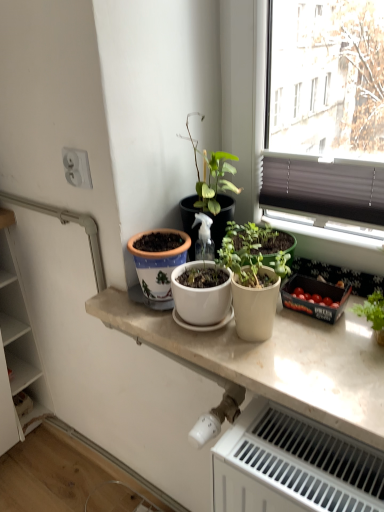
Where is `white wood cabinet at left`? Image resolution: width=384 pixels, height=512 pixels. white wood cabinet at left is located at coordinates (20, 336).

Locate an element on the screen. This screenshot has width=384, height=512. white plastic radiator at lower right is located at coordinates (293, 466).

In order to face white plastic electrical outlet at upper left, should I rotate leftwards or rightwards?

To face it directly, rotate left by 15.614 degrees.

The image size is (384, 512). Describe the element at coordinates (77, 168) in the screenshot. I see `white plastic electrical outlet at upper left` at that location.

Locate an element on the screen. The image size is (384, 512). matte white pot at center is located at coordinates (253, 279).

Is point (79, 173) in front of point (158, 280)?

No, it is behind (158, 280).

Does white plastic electrical outlet at upper left turn towards white ceramic pot at center?

No, white plastic electrical outlet at upper left is not aimed at white ceramic pot at center.

What's the angular difference between white plastic electrical outlet at upper left and white ceramic pot at center's facing directions?

The angle between the facing direction of white plastic electrical outlet at upper left and the facing direction of white ceramic pot at center is 0.23 degrees.

Looking at this image, is there a large distance between white plastic electrical outlet at upper left and white ceramic pot at center?

white plastic electrical outlet at upper left is near white ceramic pot at center, not far away.

From a real-world perspective, is white wood cabinet at left beneath white ceramic pot at center?

Indeed, from a real-world perspective, white wood cabinet at left is positioned beneath white ceramic pot at center.

Is white wood cabinet at left not within white ceramic pot at center?

Absolutely, white wood cabinet at left is external to white ceramic pot at center.

Does point (32, 335) appear closer or farther from the camera than point (180, 257)?

Clearly, point (32, 335) is more distant from the camera than point (180, 257).

Which object is wider, white plastic radiator at lower right or white plastic electrical outlet at upper left?

white plastic radiator at lower right.

Is white plastic electrical outlet at upper left completely or partially inside white plastic radiator at lower right?

No, white plastic electrical outlet at upper left is not inside white plastic radiator at lower right.

Does white plastic radiator at lower right have a larger size compared to white plastic electrical outlet at upper left?

Indeed, white plastic radiator at lower right has a larger size compared to white plastic electrical outlet at upper left.

Does white matte countertop at center contain white plastic electrical outlet at upper left?

No.

Image resolution: width=384 pixels, height=512 pixels. I want to click on electric outlet behind the white matte countertop at center, so click(x=77, y=168).

Considering the sizes of objects white matte countertop at center and white plastic electrical outlet at upper left in the image provided, who is taller, white matte countertop at center or white plastic electrical outlet at upper left?

white plastic electrical outlet at upper left is taller.

Is white plastic electrical outlet at upper left oriented towards white matte countertop at center?

No, white plastic electrical outlet at upper left is not facing towards white matte countertop at center.

Which of these two, white plastic electrical outlet at upper left or white matte countertop at center, is wider?

Wider between the two is white matte countertop at center.

Is white plastic electrical outlet at upper left shorter than white matte countertop at center?

No, white plastic electrical outlet at upper left is not shorter than white matte countertop at center.

From the image's perspective, is white plastic electrical outlet at upper left above white matte countertop at center?

Indeed, from the image's perspective, white plastic electrical outlet at upper left is shown above white matte countertop at center.

Does point (243, 236) appear closer or farther from the camera than point (175, 234)?

Point (243, 236) appears to be closer to the viewer than point (175, 234).

Does matte white pot at center appear on the left side of white ceramic pot at center?

In fact, matte white pot at center is to the right of white ceramic pot at center.

From the image's perspective, would you say matte white pot at center is positioned over white ceramic pot at center?

No, from the image's perspective, matte white pot at center is not above white ceramic pot at center.

From a real-world perspective, between matte white pot at center and white ceramic pot at center, who is vertically higher?

From a 3D spatial view, matte white pot at center is above.

Where is `radiator that appears on the right of matte white pot at center`? This screenshot has height=512, width=384. radiator that appears on the right of matte white pot at center is located at coordinates (293, 466).

From a real-world perspective, is white plastic radiator at lower right above or below matte white pot at center?

From a real-world perspective, white plastic radiator at lower right is physically below matte white pot at center.

Based on the photo, are white plastic radiator at lower right and matte white pot at center located far from each other?

No.

Locate an element on the screen. The width and height of the screenshot is (384, 512). flowerpot below the white plastic electrical outlet at upper left (from the image's perspective) is located at coordinates (158, 266).

The image size is (384, 512). What are the coordinates of `flowerpot in front of the white wood cabinet at left` in the screenshot? It's located at (158, 266).

Estimate the real-world distances between objects in this image. Which object is closer to white plastic radiator at lower right, white ceramic pot at center or matte white pot at center?

matte white pot at center lies closer to white plastic radiator at lower right than the other object.

From the image, which object appears to be nearer to white plastic radiator at lower right, white wood cabinet at left or white plastic electrical outlet at upper left?

Based on the image, white plastic electrical outlet at upper left appears to be nearer to white plastic radiator at lower right.

Estimate the real-world distances between objects in this image. Which object is further from matte white pot at center, white ceramic pot at center or white plastic electrical outlet at upper left?

white plastic electrical outlet at upper left is positioned further to the anchor matte white pot at center.

Which object lies further to the anchor point white wood cabinet at left, white plastic electrical outlet at upper left or white ceramic pot at center?

Among the two, white plastic electrical outlet at upper left is located further to white wood cabinet at left.

Based on the photo, estimate the real-world distances between objects in this image. Which object is further from white ceramic pot at center, white wood cabinet at left or white plastic radiator at lower right?

Based on the image, white wood cabinet at left appears to be further to white ceramic pot at center.

Which object lies further to the anchor point white ceramic pot at center, matte white pot at center or white plastic radiator at lower right?

Based on the image, white plastic radiator at lower right appears to be further to white ceramic pot at center.

Based on their spatial positions, is white plastic electrical outlet at upper left or white plastic radiator at lower right further from matte white pot at center?

white plastic electrical outlet at upper left lies further to matte white pot at center than the other object.

Which object lies nearer to the anchor point white wood cabinet at left, white plastic radiator at lower right or matte white pot at center?

Among the two, matte white pot at center is located nearer to white wood cabinet at left.

Image resolution: width=384 pixels, height=512 pixels. In order to click on flowerpot between white plastic electrical outlet at upper left and white plastic radiator at lower right vertically in this screenshot , I will do `click(158, 266)`.

Locate an element on the screen. houseplant between white wood cabinet at left and white plastic radiator at lower right in the horizontal direction is located at coordinates pos(253,279).

Where is `flowerpot between white wood cabinet at left and white matte countertop at center from left to right`? flowerpot between white wood cabinet at left and white matte countertop at center from left to right is located at coordinates (158, 266).

Find the location of a particular element. electric outlet between white wood cabinet at left and white plastic radiator at lower right in the horizontal direction is located at coordinates (77, 168).